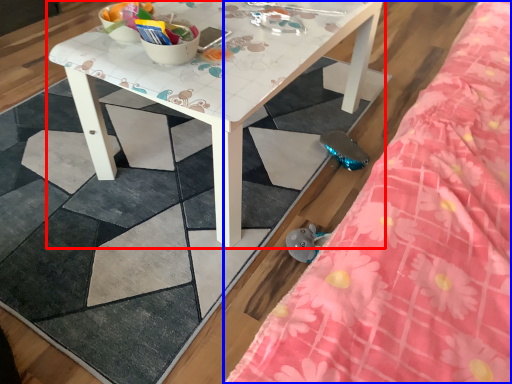
Question: Which of the following is the farthest to the observer, table (highlighted by a red box) or bed (highlighted by a blue box)?

Choices:
 (A) table
 (B) bed

Answer: (A)